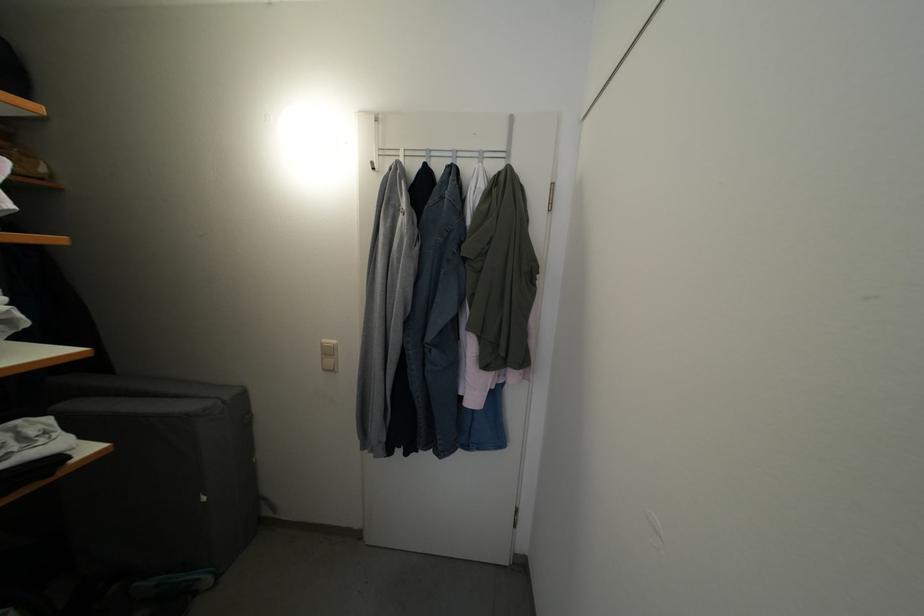
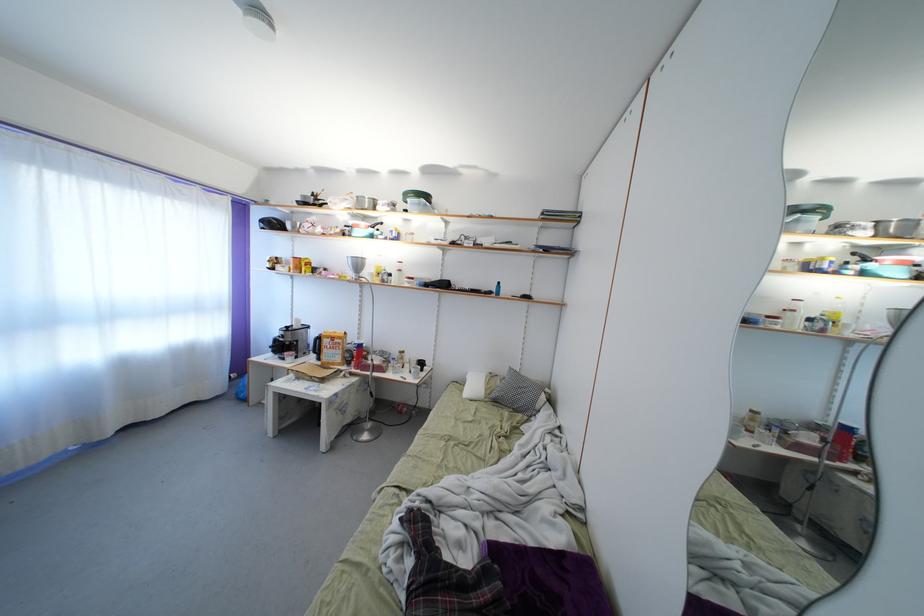
Question: Based on the continuous images, in which direction is the camera rotating? Reply with the corresponding letter.

Choices:
 (A) Left
 (B) Right
 (C) Up
 (D) Down

Answer: (A)